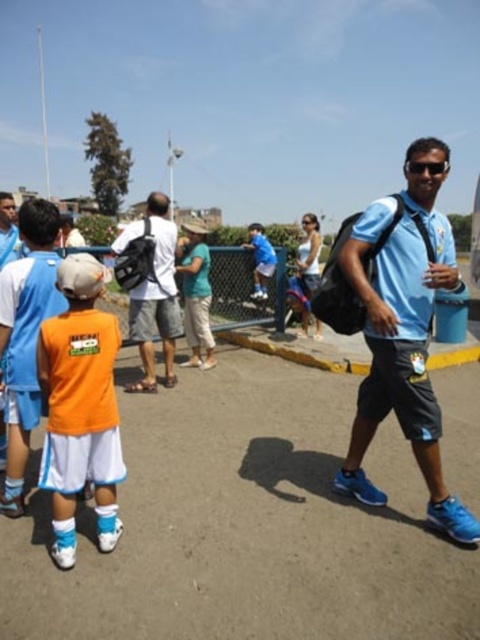
Question: Which of the following is the farthest from the observer?

Choices:
 (A) light blue fabric shirt at center
 (B) orange fabric shirt at left
 (C) matte black backpack at center

Answer: (C)

Question: Can you confirm if orange fabric shirt at left is positioned above matte black backpack at center?

Choices:
 (A) yes
 (B) no

Answer: (B)

Question: Considering the relative positions of orange fabric shirt at left and matte black backpack at center in the image provided, where is orange fabric shirt at left located with respect to matte black backpack at center?

Choices:
 (A) below
 (B) above

Answer: (A)

Question: Does orange fabric shirt at left appear on the right side of matte black backpack at center?

Choices:
 (A) no
 (B) yes

Answer: (B)

Question: Which point appears closest to the camera in this image?

Choices:
 (A) (154, 316)
 (B) (72, 422)
 (C) (440, 504)

Answer: (B)

Question: Which point is closer to the camera taking this photo?

Choices:
 (A) (428, 196)
 (B) (154, 356)
 (C) (117, 532)

Answer: (C)